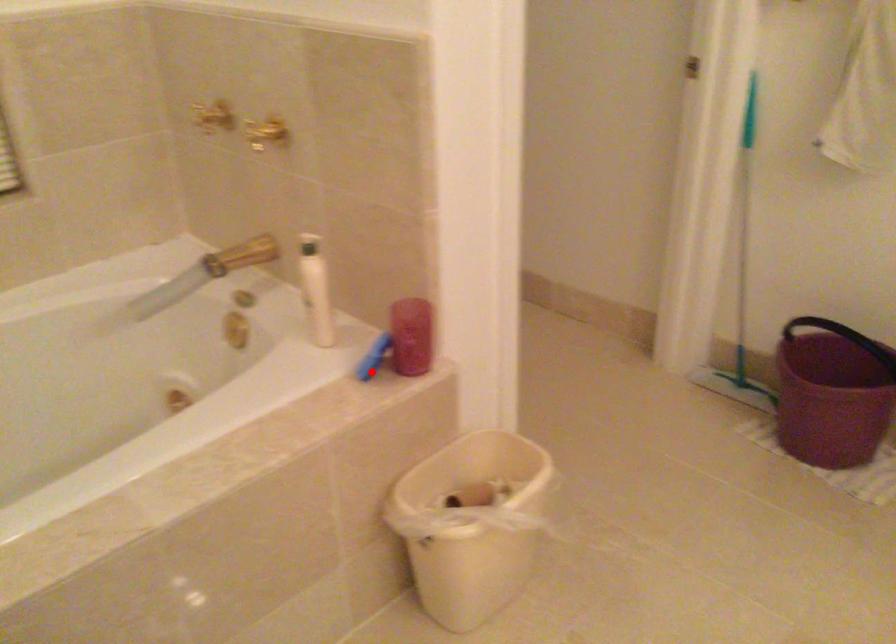
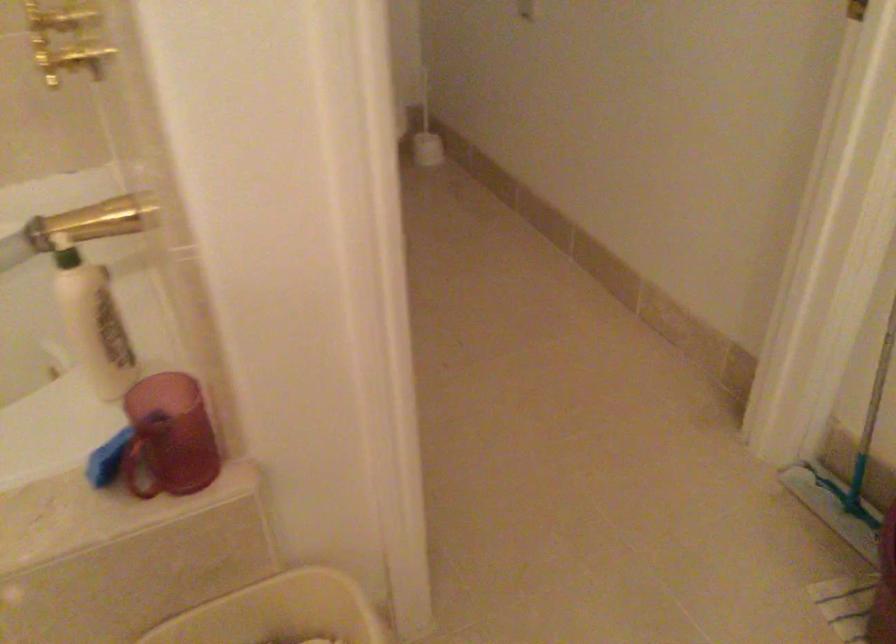
The point at the highlighted location is marked in the first image. Where is the corresponding point in the second image?

(140, 462)